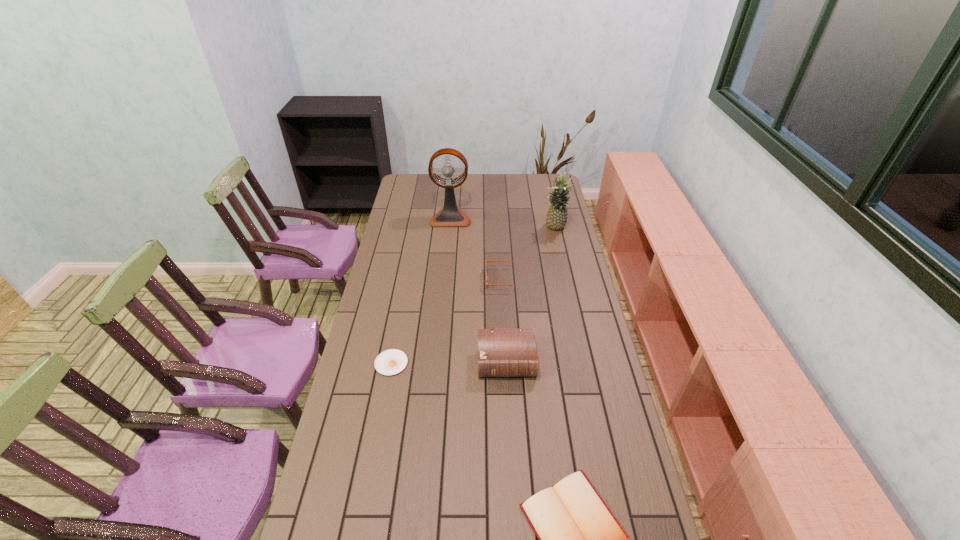
Locate an element on the screen. Image resolution: width=960 pixels, height=540 pixels. free location that satisfies the following two spatial constraints: 1. on the front-facing side of the second tallest object; 2. on the left side of the tallest object is located at coordinates (449, 228).